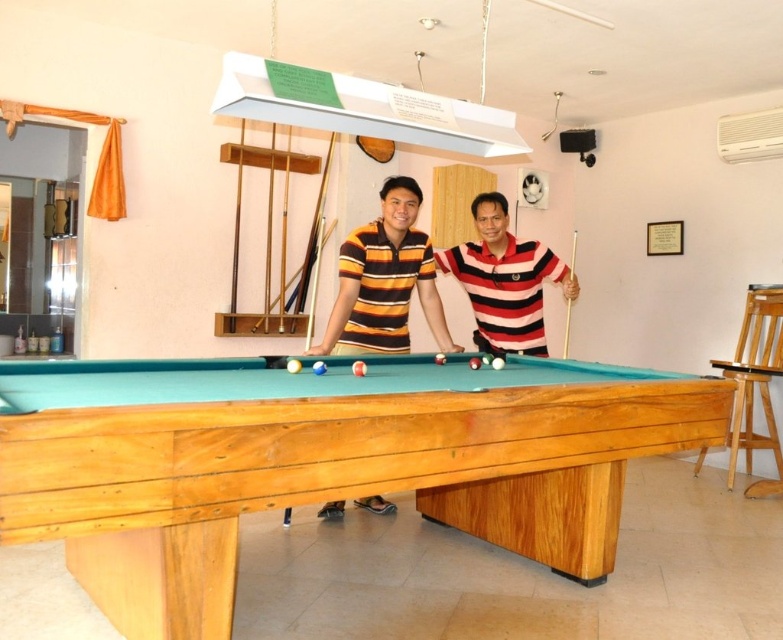
Can you confirm if striped jersey at center is positioned to the left of striped polo shirt at center?

Indeed, striped jersey at center is positioned on the left side of striped polo shirt at center.

Which is behind, point (354, 273) or point (522, 323)?

The point (522, 323) is behind.

Does point (345, 276) come behind point (466, 260)?

No, (345, 276) is in front of (466, 260).

Identify the location of striped jersey at center. This screenshot has height=640, width=783. (384, 280).

Can you confirm if natural wood billiard table at center is positioned to the left of striped jersey at center?

No, natural wood billiard table at center is not to the left of striped jersey at center.

Does natural wood billiard table at center come in front of striped jersey at center?

Yes, natural wood billiard table at center is closer to the viewer.

Is point (579, 378) less distant than point (431, 272)?

Yes, point (579, 378) is in front of point (431, 272).

Locate an element on the screen. The height and width of the screenshot is (640, 783). natural wood billiard table at center is located at coordinates click(320, 461).

Does natural wood billiard table at center appear over striped polo shirt at center?

Actually, natural wood billiard table at center is below striped polo shirt at center.

Consider the image. Is natural wood billiard table at center in front of striped polo shirt at center?

Yes, it is in front of striped polo shirt at center.

The width and height of the screenshot is (783, 640). Identify the location of natural wood billiard table at center. (320, 461).